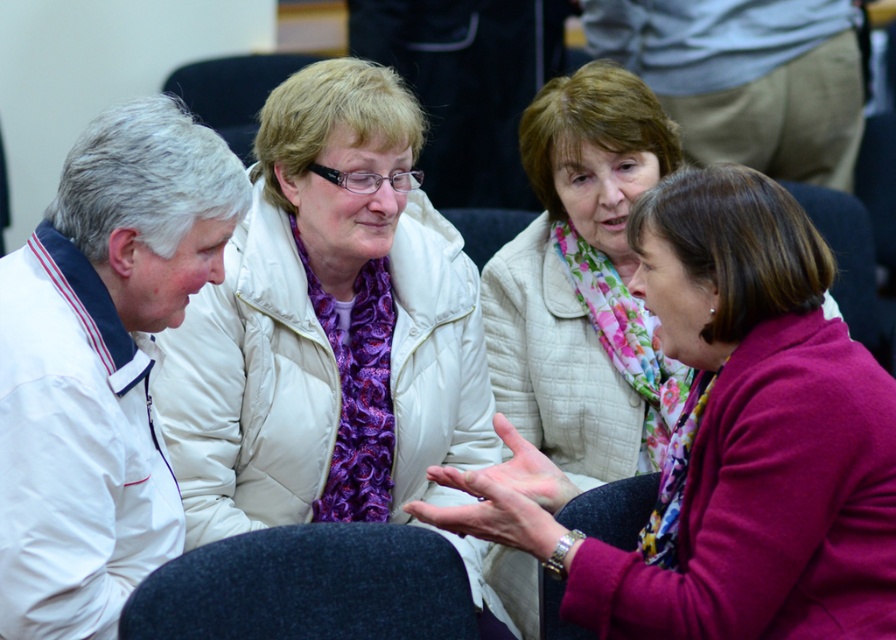
Which is more to the right, floral scarf at center or white quilted jacket at upper center?

From the viewer's perspective, floral scarf at center appears more on the right side.

Between floral scarf at center and white quilted jacket at upper center, which one appears on the left side from the viewer's perspective?

Positioned to the left is white quilted jacket at upper center.

Image resolution: width=896 pixels, height=640 pixels. Find the location of `floral scarf at center`. floral scarf at center is located at coordinates (729, 442).